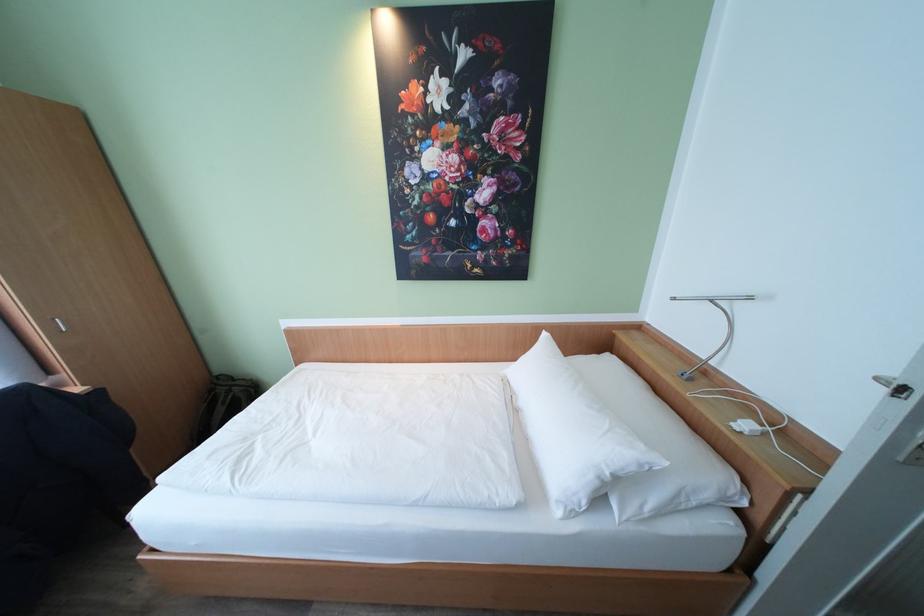
Describe the element at coordinates (59, 323) in the screenshot. The height and width of the screenshot is (616, 924). I see `a silver cabinet handle` at that location.